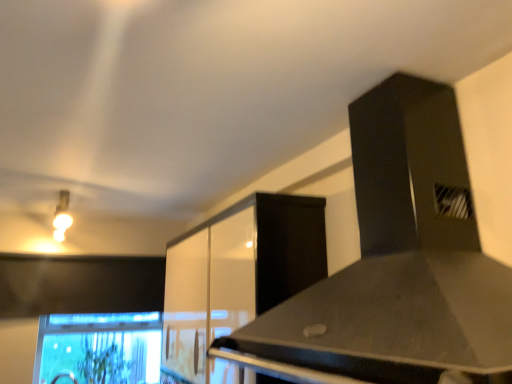
Question: Should I look upward or downward to see green leafy plant at lower left?

Choices:
 (A) down
 (B) up

Answer: (A)

Question: From the image's perspective, would you say glossy white cabinet at center is shown under green leafy plant at lower left?

Choices:
 (A) yes
 (B) no

Answer: (B)

Question: Is glossy white cabinet at center turned away from green leafy plant at lower left?

Choices:
 (A) no
 (B) yes

Answer: (A)

Question: Is glossy white cabinet at center wider than green leafy plant at lower left?

Choices:
 (A) yes
 (B) no

Answer: (A)

Question: From a real-world perspective, does glossy white cabinet at center stand above green leafy plant at lower left?

Choices:
 (A) no
 (B) yes

Answer: (B)

Question: Are glossy white cabinet at center and green leafy plant at lower left far apart?

Choices:
 (A) no
 (B) yes

Answer: (B)

Question: Considering the relative sizes of glossy white cabinet at center and green leafy plant at lower left in the image provided, is glossy white cabinet at center bigger than green leafy plant at lower left?

Choices:
 (A) yes
 (B) no

Answer: (A)

Question: Does black matte vent at upper right have a lesser width compared to clear glass monitor at lower left?

Choices:
 (A) no
 (B) yes

Answer: (A)

Question: From the image's perspective, does black matte vent at upper right appear lower than clear glass monitor at lower left?

Choices:
 (A) yes
 (B) no

Answer: (B)

Question: Is black matte vent at upper right oriented towards clear glass monitor at lower left?

Choices:
 (A) no
 (B) yes

Answer: (A)

Question: From a real-world perspective, is black matte vent at upper right over clear glass monitor at lower left?

Choices:
 (A) yes
 (B) no

Answer: (A)

Question: Does black matte vent at upper right have a larger size compared to clear glass monitor at lower left?

Choices:
 (A) yes
 (B) no

Answer: (A)

Question: From a real-world perspective, is black matte vent at upper right beneath clear glass monitor at lower left?

Choices:
 (A) no
 (B) yes

Answer: (A)

Question: Does matte gold light fixture at upper left have a lesser width compared to black matte vent at upper right?

Choices:
 (A) yes
 (B) no

Answer: (B)